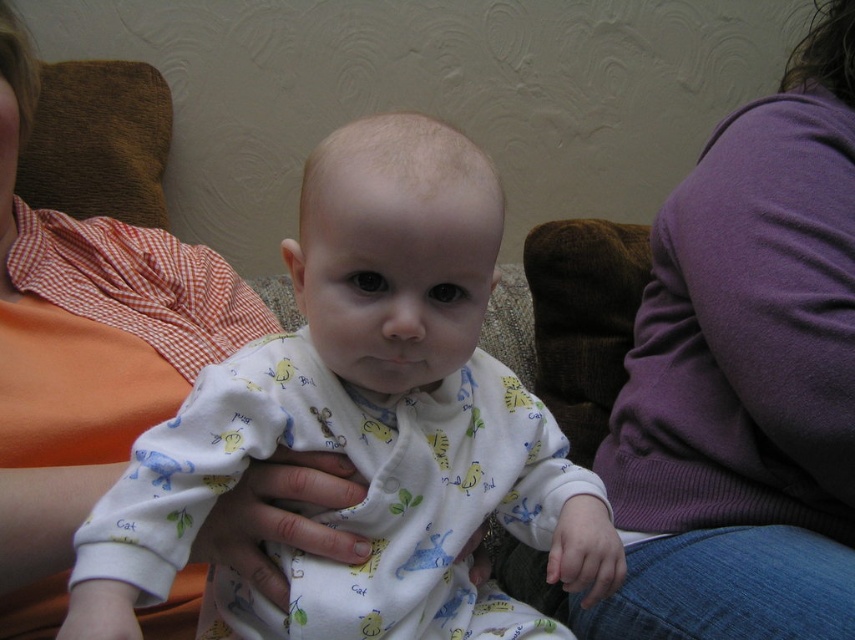
Question: Which of the following is the farthest from the observer?

Choices:
 (A) (464, 433)
 (B) (63, 332)
 (C) (674, 509)

Answer: (C)

Question: Is white cotton onesie at center smaller than orange cotton shirt at left?

Choices:
 (A) yes
 (B) no

Answer: (A)

Question: Among these objects, which one is farthest from the camera?

Choices:
 (A) orange cotton shirt at left
 (B) purple sweater at upper right
 (C) white cotton onesie at center

Answer: (B)

Question: Is white cotton onesie at center further to the viewer compared to purple sweater at upper right?

Choices:
 (A) yes
 (B) no

Answer: (B)

Question: Is white cotton onesie at center thinner than purple sweater at upper right?

Choices:
 (A) no
 (B) yes

Answer: (A)

Question: Which is farther from the white cotton onesie at center?

Choices:
 (A) orange cotton shirt at left
 (B) purple sweater at upper right

Answer: (B)